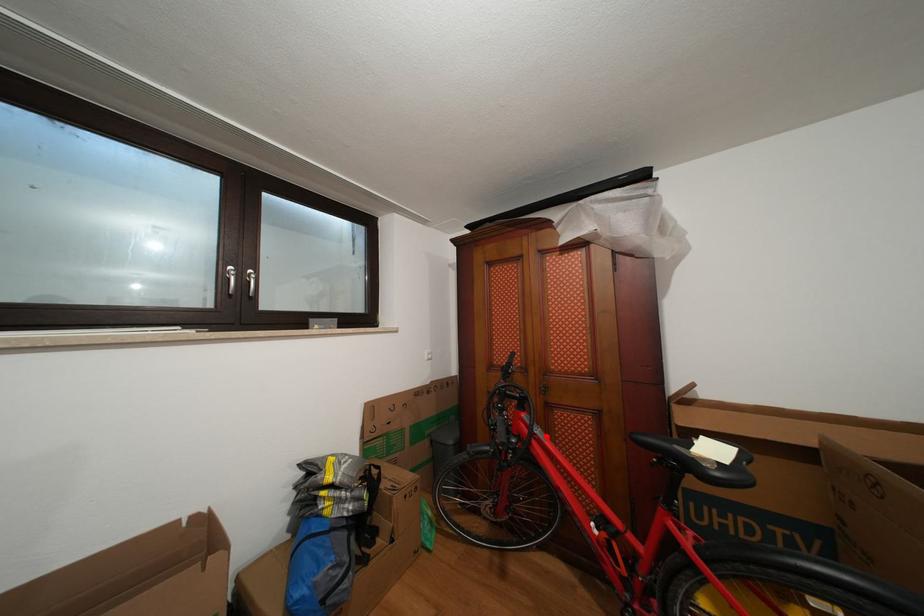
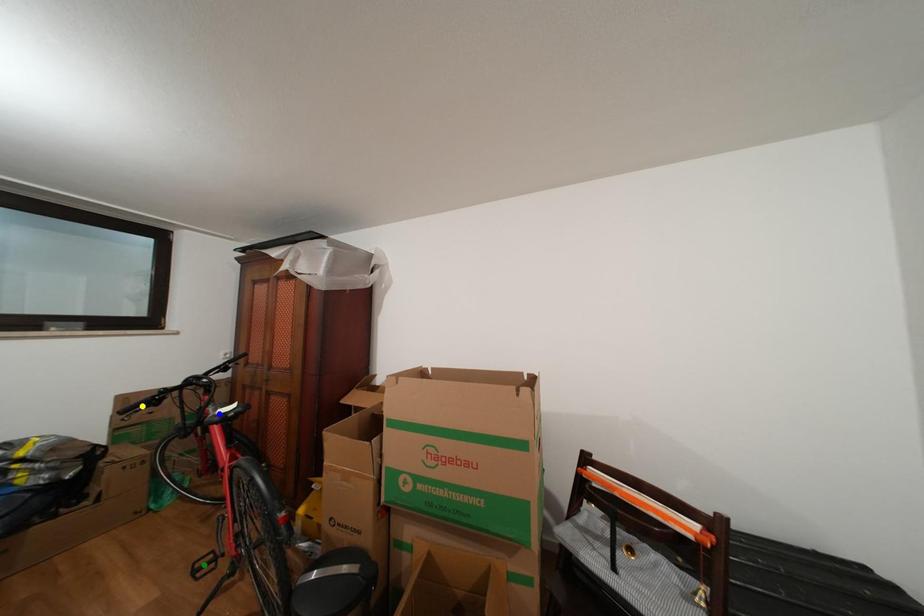
Question: I am providing you with two images of the same scene from different viewpoints. A red point is marked on the first image. You are given multiple points on the second image. Which mark in image 2 goes with the point in image 1?

Choices:
 (A) yellow point
 (B) green point
 (C) blue point

Answer: (C)